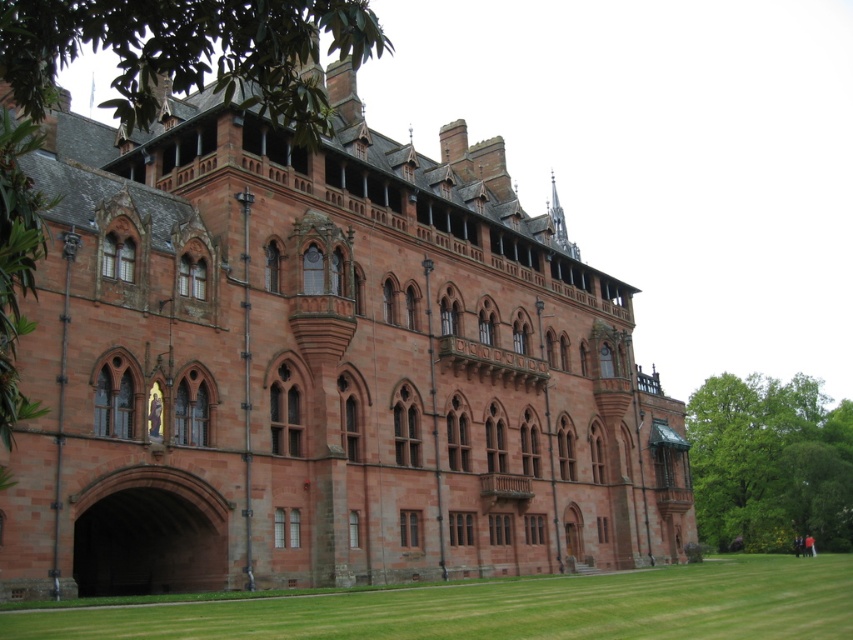
You are standing in front of the grand historic building and notice the green grass at lower center and the green leafy tree at upper center. From your perspective, which object is positioned to the left?

The green leafy tree at upper center is positioned to the left of the green grass at lower center.

You are standing in front of the grand historic building and notice two points marked on its facade. The first point is located at coordinates point (65,624), and the second is at point (813,397). Which of these points is nearer to your current position?

Point (65,624) is closer to the viewer than point (813,397), so the first point is nearer to your current position.